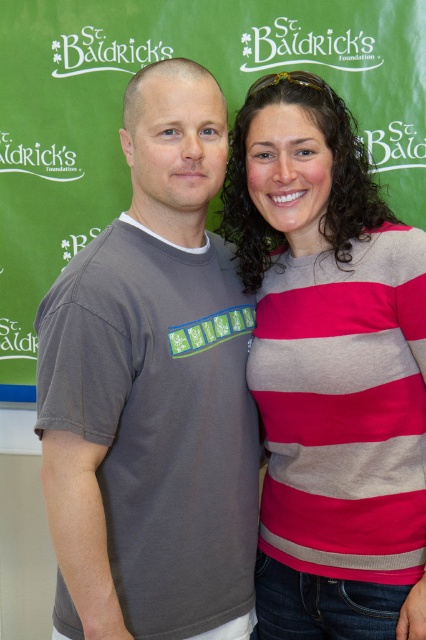
Question: Which object is the farthest from the white matte text at upper center?

Choices:
 (A) gray cotton t-shirt at left
 (B) matte gray t-shirt at center

Answer: (A)

Question: Can you confirm if matte gray t-shirt at center is bigger than white matte text at upper center?

Choices:
 (A) yes
 (B) no

Answer: (A)

Question: Does striped sweater at right have a lesser width compared to matte gray t-shirt at center?

Choices:
 (A) no
 (B) yes

Answer: (B)

Question: Which of the following is the farthest from the observer?

Choices:
 (A) white matte text at upper center
 (B) matte gray t-shirt at center

Answer: (A)

Question: From the image, what is the correct spatial relationship of matte gray t-shirt at center in relation to white matte text at upper center?

Choices:
 (A) below
 (B) above

Answer: (A)

Question: Considering the real-world distances, which object is farthest from the striped sweater at right?

Choices:
 (A) gray cotton t-shirt at left
 (B) white matte text at upper center
 (C) matte gray t-shirt at center

Answer: (B)